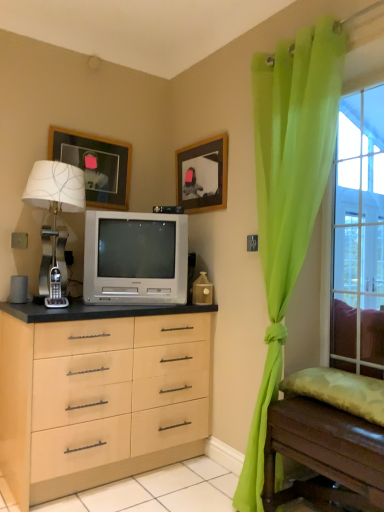
Question: Which direction should I rotate to look at wooden picture frame at upper center, which is the first picture frame in right-to-left order?

Choices:
 (A) right
 (B) left

Answer: (A)

Question: Is silver metallic table lamp at left positioned with its back to green sheer curtain at right?

Choices:
 (A) yes
 (B) no

Answer: (B)

Question: From the image's perspective, is silver metallic table lamp at left on top of green sheer curtain at right?

Choices:
 (A) yes
 (B) no

Answer: (A)

Question: Considering the relative sizes of silver metallic table lamp at left and green sheer curtain at right in the image provided, is silver metallic table lamp at left wider than green sheer curtain at right?

Choices:
 (A) yes
 (B) no

Answer: (A)

Question: Are silver metallic table lamp at left and green sheer curtain at right located far from each other?

Choices:
 (A) no
 (B) yes

Answer: (B)

Question: Are silver metallic table lamp at left and green sheer curtain at right beside each other?

Choices:
 (A) yes
 (B) no

Answer: (B)

Question: Considering the relative sizes of silver metallic table lamp at left and green sheer curtain at right in the image provided, is silver metallic table lamp at left taller than green sheer curtain at right?

Choices:
 (A) yes
 (B) no

Answer: (B)

Question: From a real-world perspective, does clear glass window at right stand above wooden table at lower right?

Choices:
 (A) no
 (B) yes

Answer: (B)

Question: Could you tell me if clear glass window at right is turned towards wooden table at lower right?

Choices:
 (A) yes
 (B) no

Answer: (B)

Question: Does clear glass window at right appear on the right side of wooden table at lower right?

Choices:
 (A) no
 (B) yes

Answer: (B)

Question: Is clear glass window at right smaller than wooden table at lower right?

Choices:
 (A) yes
 (B) no

Answer: (A)

Question: Considering the relative sizes of clear glass window at right and wooden table at lower right in the image provided, is clear glass window at right taller than wooden table at lower right?

Choices:
 (A) no
 (B) yes

Answer: (B)

Question: Does clear glass window at right have a lesser height compared to wooden table at lower right?

Choices:
 (A) no
 (B) yes

Answer: (A)

Question: Can you confirm if wooden table at lower right is taller than clear glass window at right?

Choices:
 (A) no
 (B) yes

Answer: (A)